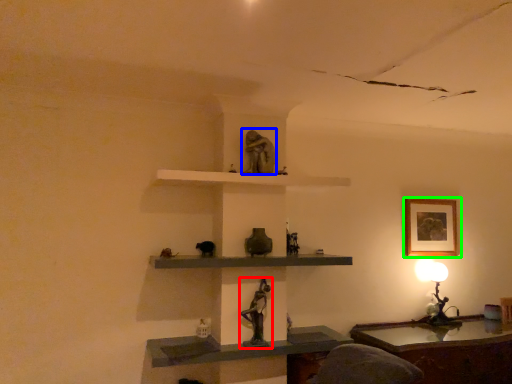
Question: Based on their relative distances, which object is farther from sculpture (highlighted by a red box)? Choose from sculpture (highlighted by a blue box) and picture frame (highlighted by a green box).

Choices:
 (A) sculpture
 (B) picture frame

Answer: (B)